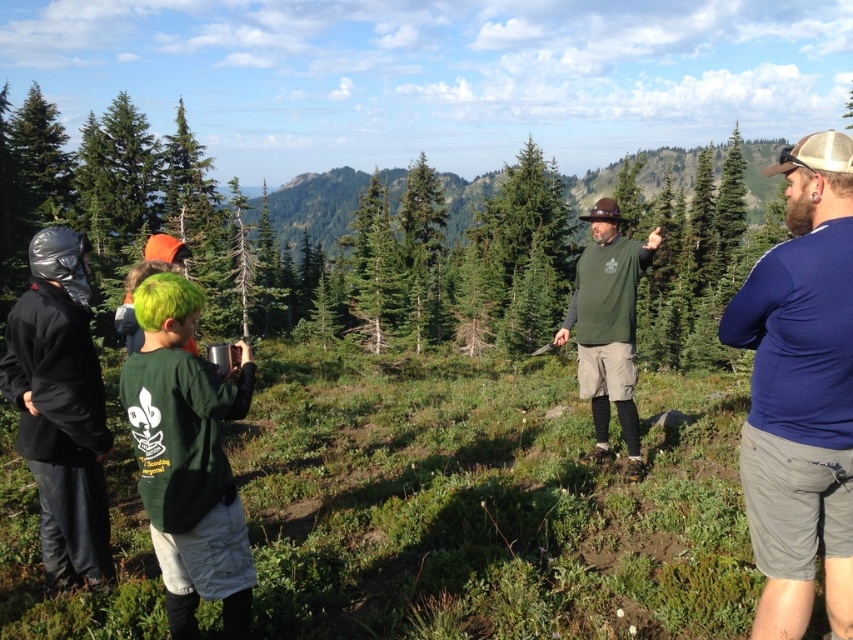
Question: Is blue long-sleeve shirt at right thinner than black matte jacket at left?

Choices:
 (A) yes
 (B) no

Answer: (B)

Question: Which object is closer to the camera taking this photo?

Choices:
 (A) black matte jacket at left
 (B) green matte shirt at lower left
 (C) blue long-sleeve shirt at right

Answer: (C)

Question: Which point is farther to the camera?

Choices:
 (A) (799, 458)
 (B) (44, 365)
 (C) (581, 364)

Answer: (C)

Question: Is blue long-sleeve shirt at right behind black matte jacket at left?

Choices:
 (A) no
 (B) yes

Answer: (A)

Question: Does blue long-sleeve shirt at right have a greater width compared to green matte shirt at center?

Choices:
 (A) yes
 (B) no

Answer: (A)

Question: Which of the following is the closest to the observer?

Choices:
 (A) blue long-sleeve shirt at right
 (B) green matte shirt at lower left
 (C) green matte shirt at center

Answer: (A)